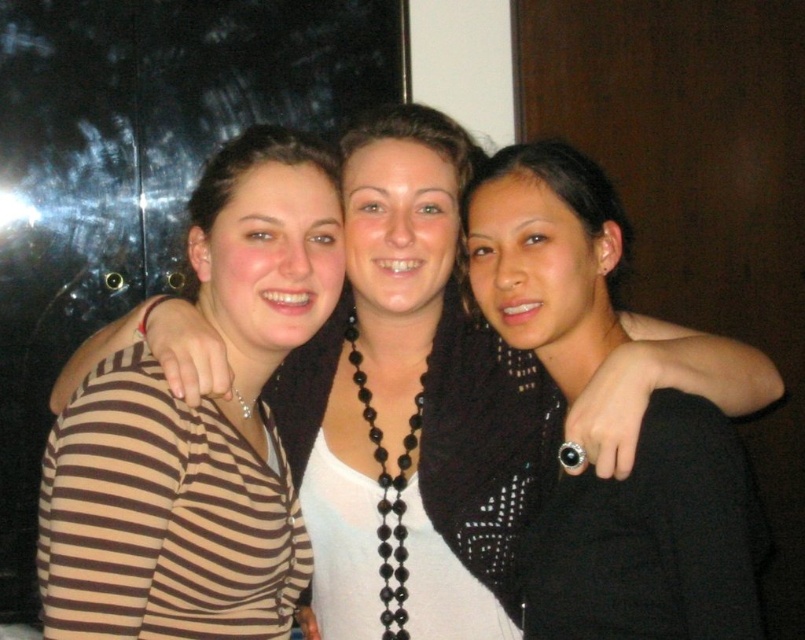
Question: Which point appears closest to the camera in this image?

Choices:
 (A) (238, 209)
 (B) (583, 305)

Answer: (B)

Question: Which point appears farthest from the camera in this image?

Choices:
 (A) (143, 499)
 (B) (595, 572)

Answer: (B)

Question: Does brown striped shirt at left have a lesser width compared to black beaded necklace at center?

Choices:
 (A) yes
 (B) no

Answer: (B)

Question: Is brown striped shirt at left thinner than black beaded necklace at center?

Choices:
 (A) yes
 (B) no

Answer: (B)

Question: Does brown striped shirt at left come behind black beaded necklace at center?

Choices:
 (A) yes
 (B) no

Answer: (A)